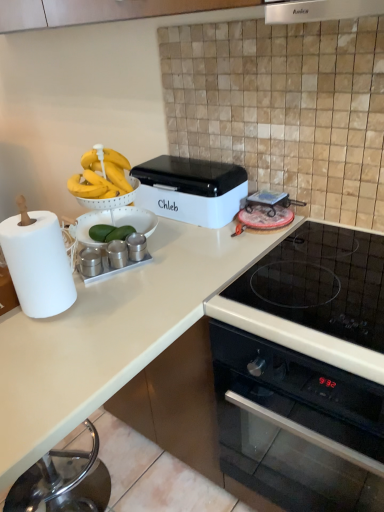
This screenshot has height=512, width=384. In order to click on free space in front of white paper at left in this screenshot , I will do `click(46, 348)`.